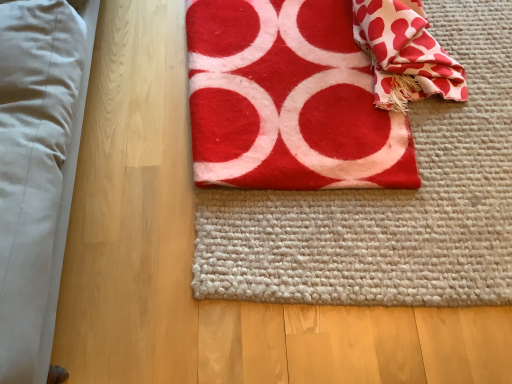
Question: Is red felt towel at center taller than red felt yoga mat at center?

Choices:
 (A) no
 (B) yes

Answer: (B)

Question: From a real-world perspective, is red felt towel at center beneath red felt yoga mat at center?

Choices:
 (A) no
 (B) yes

Answer: (A)

Question: From a real-world perspective, is red felt towel at center on red felt yoga mat at center?

Choices:
 (A) no
 (B) yes

Answer: (B)

Question: Is red felt towel at center to the left of red felt yoga mat at center from the viewer's perspective?

Choices:
 (A) yes
 (B) no

Answer: (A)

Question: Is red felt towel at center positioned with its back to red felt yoga mat at center?

Choices:
 (A) yes
 (B) no

Answer: (B)

Question: Can you confirm if red felt towel at center is thinner than red felt yoga mat at center?

Choices:
 (A) yes
 (B) no

Answer: (A)

Question: Would you consider white textured fabric at upper right to be distant from red felt towel at center?

Choices:
 (A) yes
 (B) no

Answer: (B)

Question: Is white textured fabric at upper right to the right of red felt towel at center from the viewer's perspective?

Choices:
 (A) yes
 (B) no

Answer: (A)

Question: From the image's perspective, does white textured fabric at upper right appear higher than red felt towel at center?

Choices:
 (A) no
 (B) yes

Answer: (B)

Question: Can you confirm if white textured fabric at upper right is positioned to the left of red felt towel at center?

Choices:
 (A) yes
 (B) no

Answer: (B)

Question: Considering the relative sizes of white textured fabric at upper right and red felt towel at center in the image provided, is white textured fabric at upper right smaller than red felt towel at center?

Choices:
 (A) yes
 (B) no

Answer: (A)

Question: Is white textured fabric at upper right located outside red felt towel at center?

Choices:
 (A) no
 (B) yes

Answer: (A)

Question: Is red felt towel at center not inside white textured fabric at upper right?

Choices:
 (A) no
 (B) yes

Answer: (B)